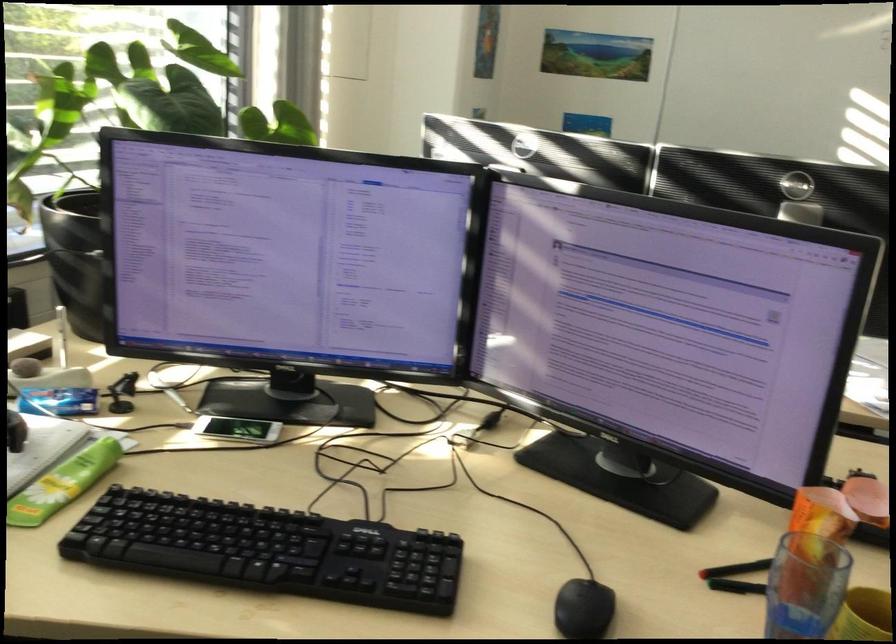
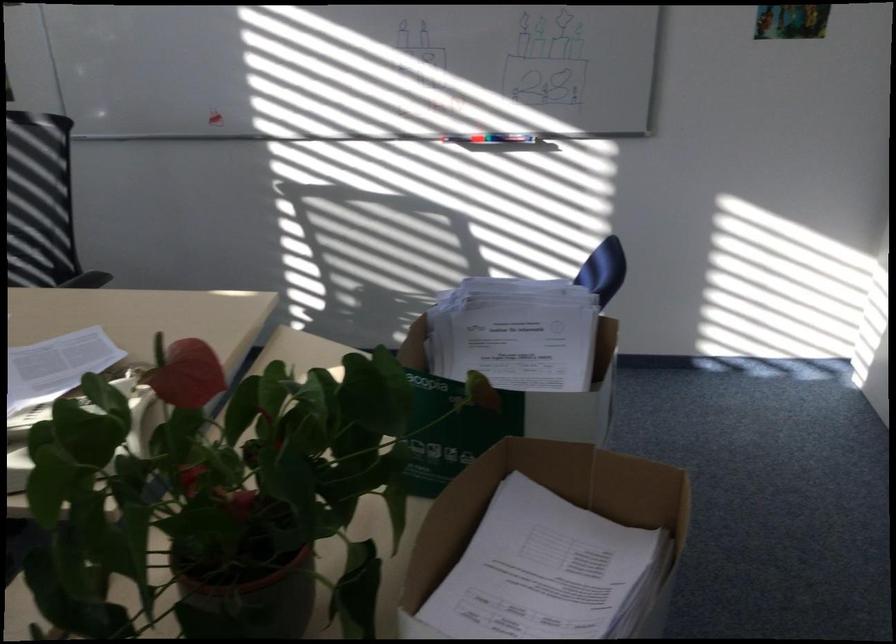
Question: In a continuous first-person perspective shot, in which direction is the camera moving?

Choices:
 (A) Left
 (B) Right
 (C) Forward
 (D) Backward

Answer: (B)